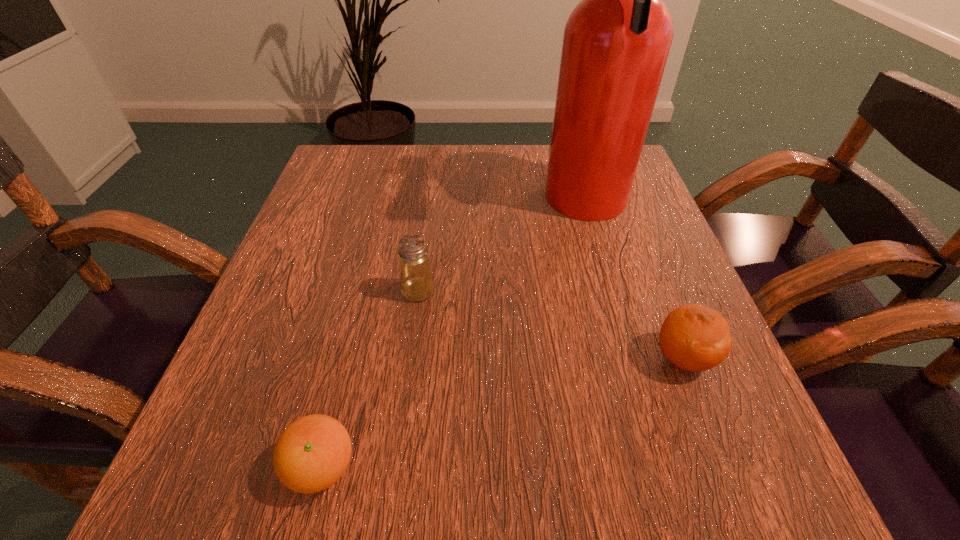
This screenshot has height=540, width=960. In order to click on fire extinguisher in this screenshot , I will do `click(616, 42)`.

This screenshot has width=960, height=540. Identify the location of the tallest object. (616, 42).

Image resolution: width=960 pixels, height=540 pixels. In order to click on the third nearest object in this screenshot , I will do pyautogui.click(x=416, y=281).

You are a GUI agent. You are given a task and a screenshot of the screen. Output one action in this format:
    pyautogui.click(x=<x>, y=<y>)
    Task: Click on the saltshaker
    This screenshot has width=960, height=540.
    Given the screenshot: What is the action you would take?
    pyautogui.click(x=416, y=281)

Locate an element on the screen. The image size is (960, 540). the taller orange is located at coordinates (695, 338).

At what (x,y) coordinates should I click in order to perform the action: click on the third farthest object. Please return your answer as a coordinate pair (x, y). Looking at the image, I should click on (695, 338).

Locate an element on the screen. The height and width of the screenshot is (540, 960). the shorter orange is located at coordinates (312, 453).

The width and height of the screenshot is (960, 540). What are the coordinates of `the nearest object` in the screenshot? It's located at (312, 453).

Identify the location of vacant space located on the front of the tallest object. This screenshot has width=960, height=540. (638, 386).

Where is `vacant area located 0.200m on the right of the second object from left to right`? vacant area located 0.200m on the right of the second object from left to right is located at coordinates (547, 291).